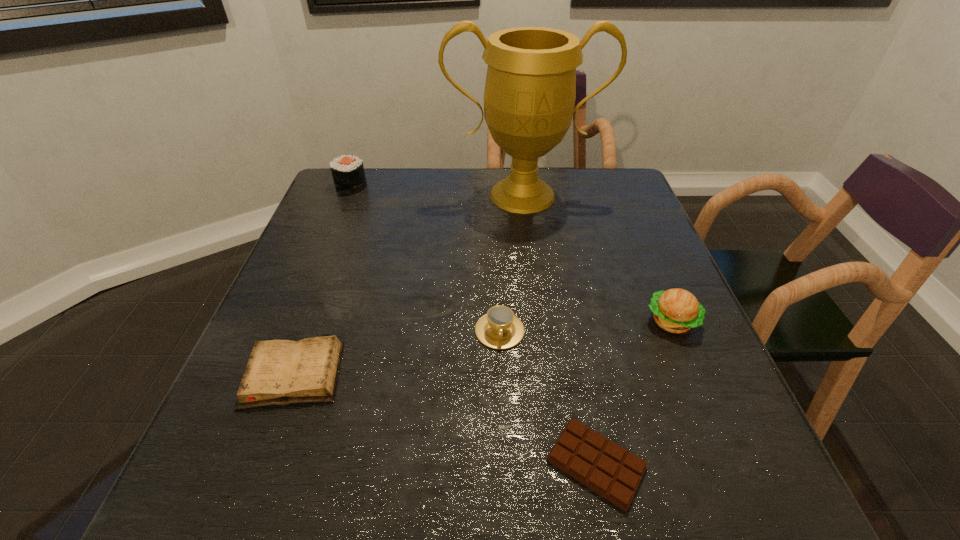
At what (x,y) coordinates should I click in order to perform the action: click on vacant region located 0.280m with the handle on the side of the cup. Please return your answer as a coordinate pair (x, y). The image size is (960, 540). Looking at the image, I should click on (507, 496).

Where is `vacant area located 0.100m on the front of the second shortest object`? The width and height of the screenshot is (960, 540). vacant area located 0.100m on the front of the second shortest object is located at coordinates (259, 467).

Find the location of a particular element. This screenshot has width=960, height=540. vacant space located on the left of the shortest object is located at coordinates (356, 463).

Locate an element on the screen. The image size is (960, 540). trophy that is at the far edge is located at coordinates (529, 97).

Locate an element on the screen. sushi that is positioned at the far edge is located at coordinates (348, 173).

Where is `object located at the near edge`? object located at the near edge is located at coordinates (608, 469).

Where is `sushi present at the left edge`? The width and height of the screenshot is (960, 540). sushi present at the left edge is located at coordinates (348, 173).

Locate an element on the screen. diary that is at the left edge is located at coordinates (x=279, y=372).

The height and width of the screenshot is (540, 960). I want to click on trophy that is positioned at the right edge, so click(529, 97).

Locate an element on the screen. hamburger at the right edge is located at coordinates (676, 310).